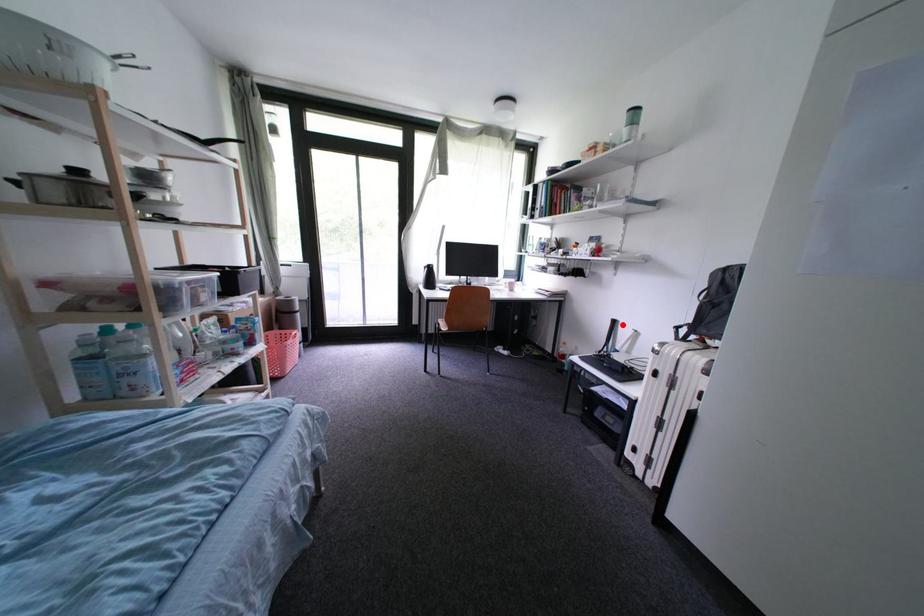
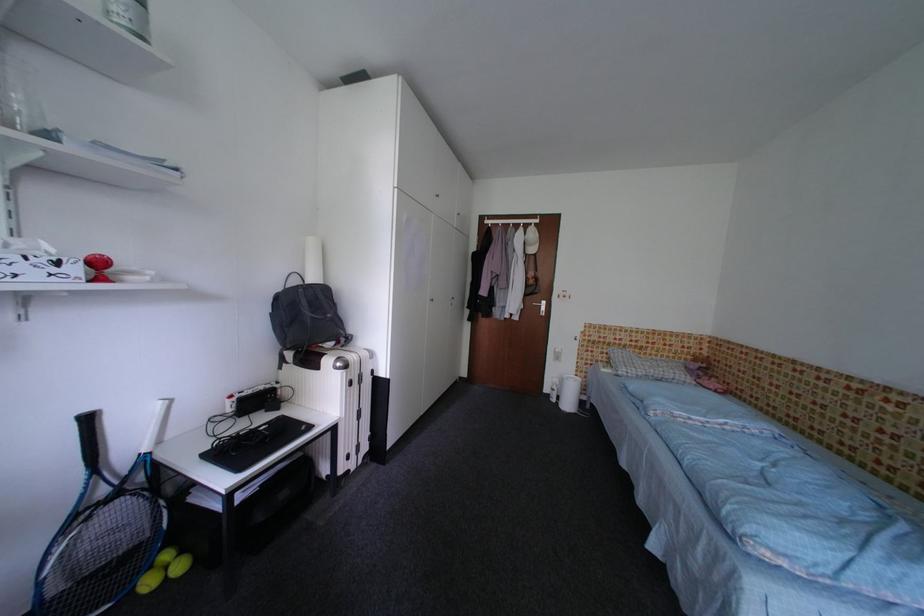
Question: I am providing you with two images of the same scene from different viewpoints. In image1, a red point is highlighted. Considering the same 3D point in image2, which of the following is correct?

Choices:
 (A) It is closer
 (B) It is farther

Answer: (B)